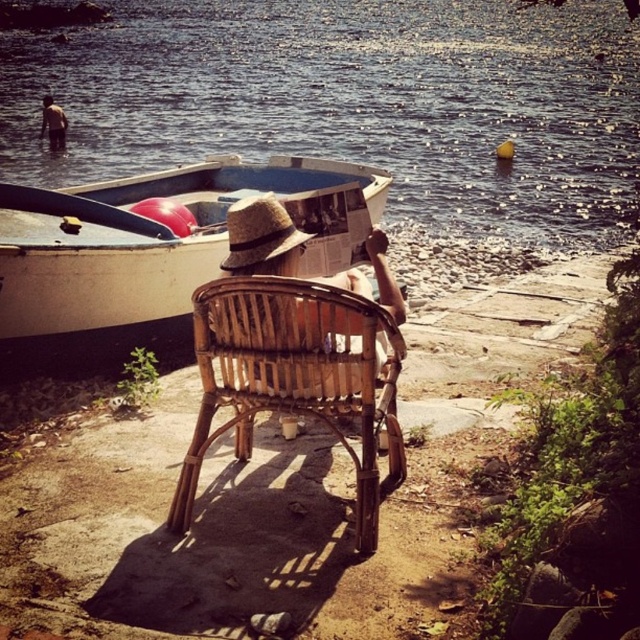
Question: Does rattan chair at center come in front of strawmaterial/texturehat at center?

Choices:
 (A) yes
 (B) no

Answer: (A)

Question: Which of the following is the farthest from the observer?

Choices:
 (A) strawmaterial/texturehat at center
 (B) blue water at center

Answer: (B)

Question: Is blue water at center thinner than brown leather jacket at upper left?

Choices:
 (A) no
 (B) yes

Answer: (A)

Question: Estimate the real-world distances between objects in this image. Which object is farther from the brown leather jacket at upper left?

Choices:
 (A) blue water at center
 (B) white matte boat at center
 (C) rattan chair at center
 (D) strawmaterial/texturehat at center

Answer: (A)

Question: Which of these objects is positioned farthest from the brown leather jacket at upper left?

Choices:
 (A) rattan chair at center
 (B) white matte boat at center
 (C) strawmaterial/texturehat at center
 (D) blue water at center

Answer: (D)

Question: Does blue water at center appear on the right side of rattan chair at center?

Choices:
 (A) no
 (B) yes

Answer: (A)